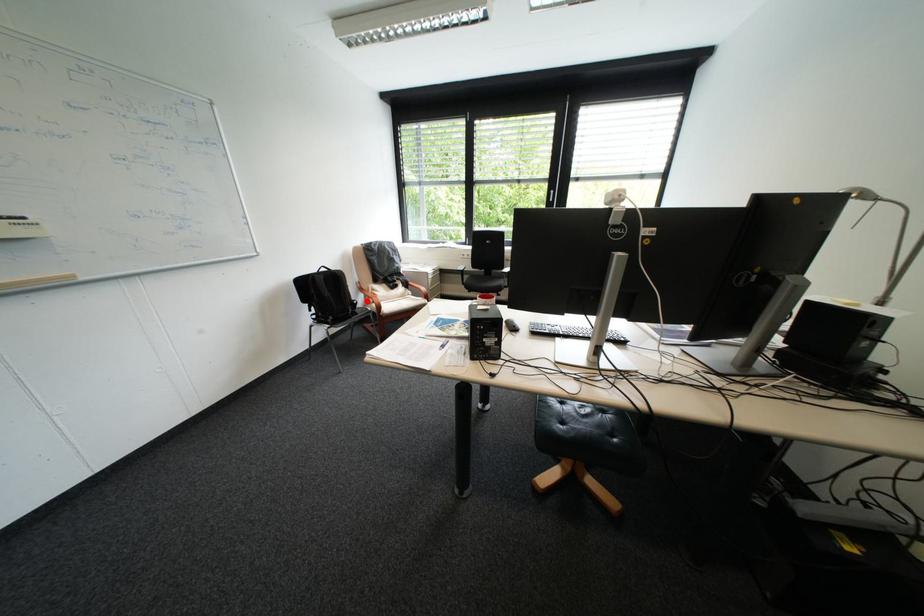
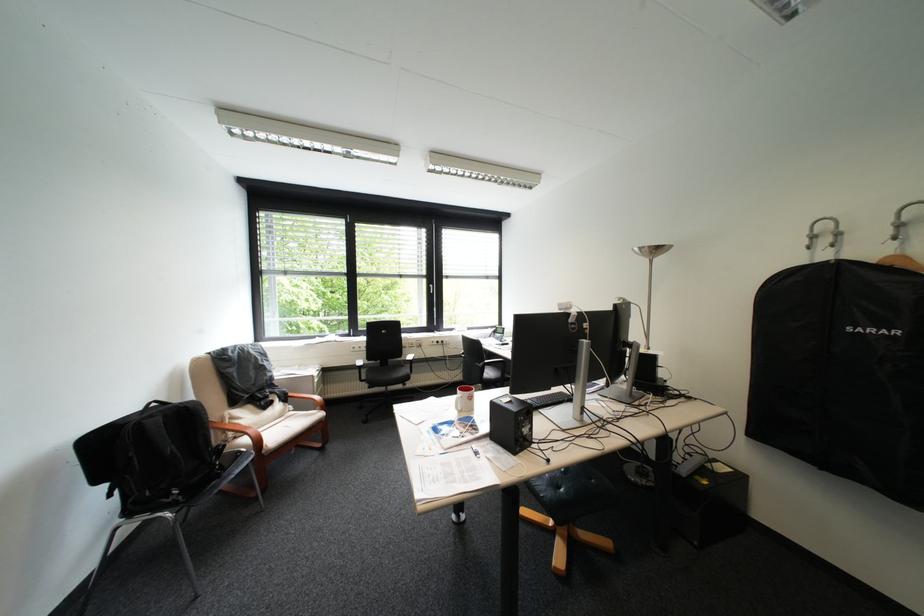
The point at the highlighted location is marked in the first image. Where is the corresponding point in the second image?

(231, 445)